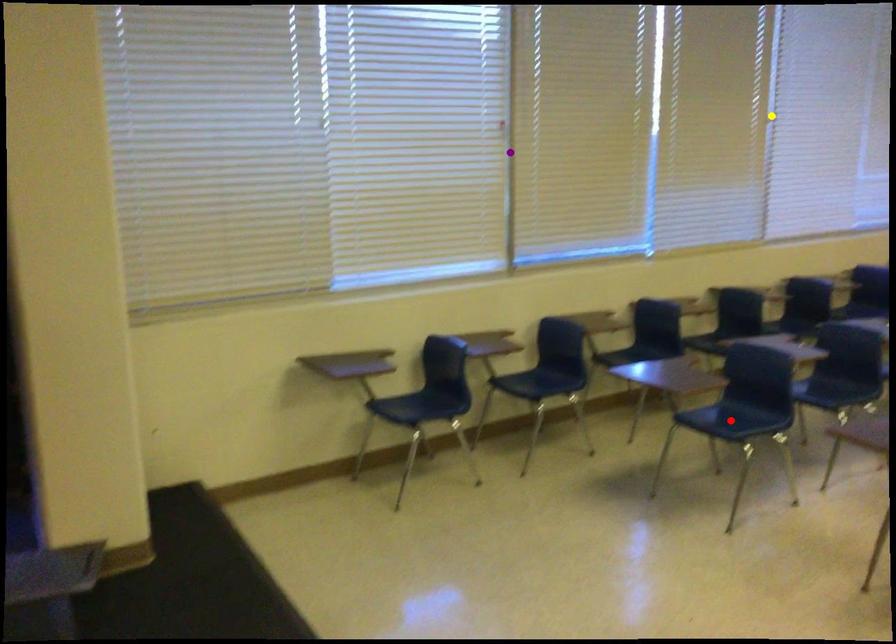
Order these from nearest to farthest:
purple point, red point, yellow point

yellow point → purple point → red point